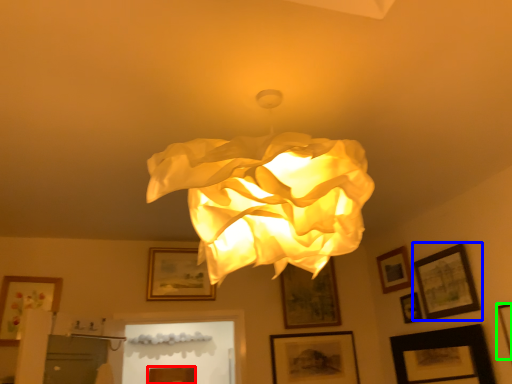
Question: Considering the real-world distances, which object is closest to picture frame (highlighted by a red box)? picture frame (highlighted by a blue box) or picture frame (highlighted by a green box).

Choices:
 (A) picture frame
 (B) picture frame

Answer: (A)